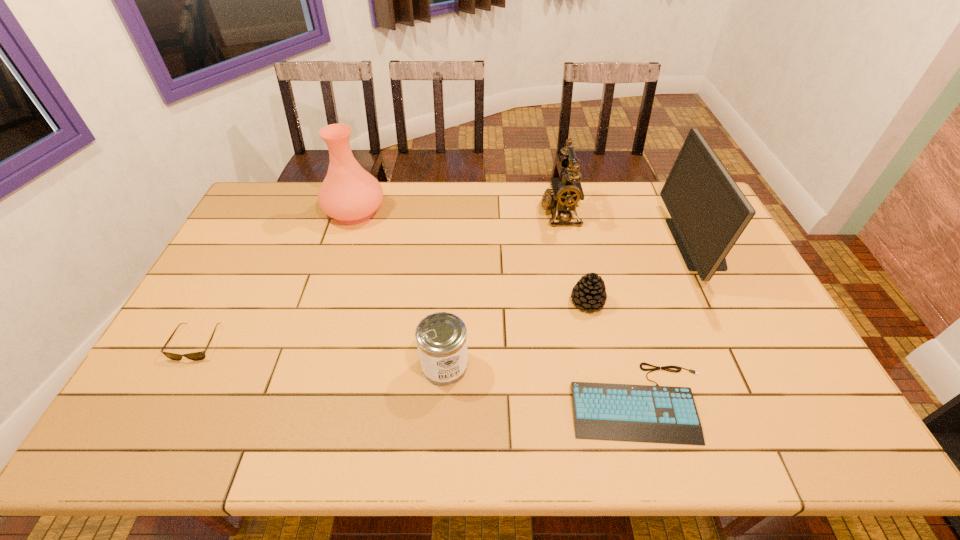
I want to click on vacant space located 0.170m on the screen side of the computer monitor, so click(x=623, y=244).

Find the location of a particular element. free region located 0.150m on the screen side of the computer monitor is located at coordinates point(629,244).

Locate an element on the screen. vacant space situated 0.250m on the screen side of the computer monitor is located at coordinates (599, 244).

Where is `vacant area situated on the rotary dial of the fifth shortest object`? vacant area situated on the rotary dial of the fifth shortest object is located at coordinates (468, 213).

I want to click on vacant region located 0.200m on the rotary dial of the fifth shortest object, so click(x=484, y=213).

This screenshot has height=540, width=960. In order to click on vacant space located on the rotary dial of the fifth shortest object in this screenshot , I will do `click(520, 213)`.

This screenshot has height=540, width=960. I want to click on vacant area situated on the back of the fourth tallest object, so click(x=450, y=278).

You are a GUI agent. You are given a task and a screenshot of the screen. Output one action in this format:
    pyautogui.click(x=<x>, y=<y>)
    Task: Click on the free region located 0.230m at the narrow end of the pinecone
    This screenshot has height=540, width=960.
    Given the screenshot: What is the action you would take?
    pyautogui.click(x=607, y=387)

Locate an element on the screen. The image size is (960, 540). free spot located 0.150m on the lenses of the leftmost object is located at coordinates (157, 416).

I want to click on vacant space situated 0.220m on the left of the shortest object, so click(479, 401).